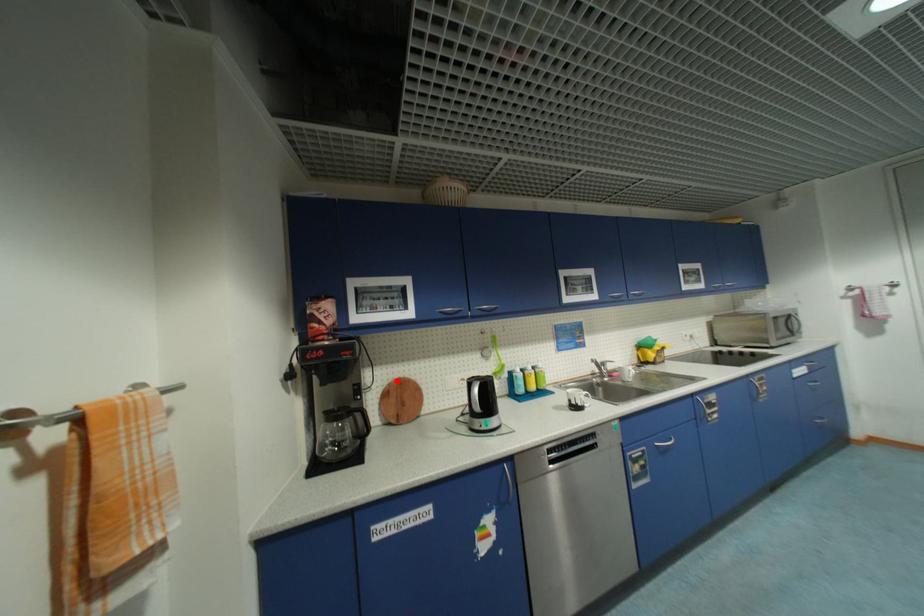
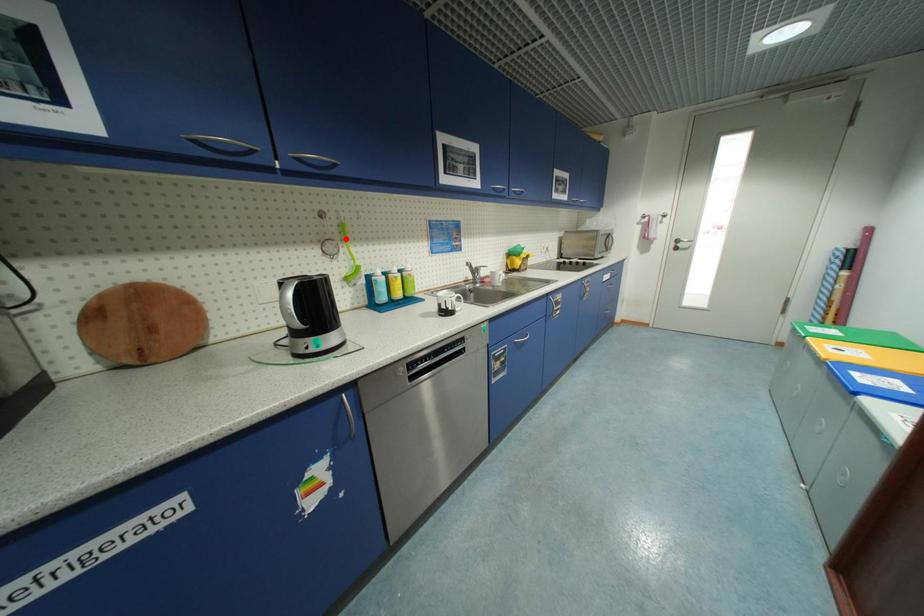
I am providing you with two images of the same scene from different viewpoints. A red point is marked on the first image and another point is marked on the second image. Do the highlighted points in image1 and image2 indicate the same real-world spot?

No